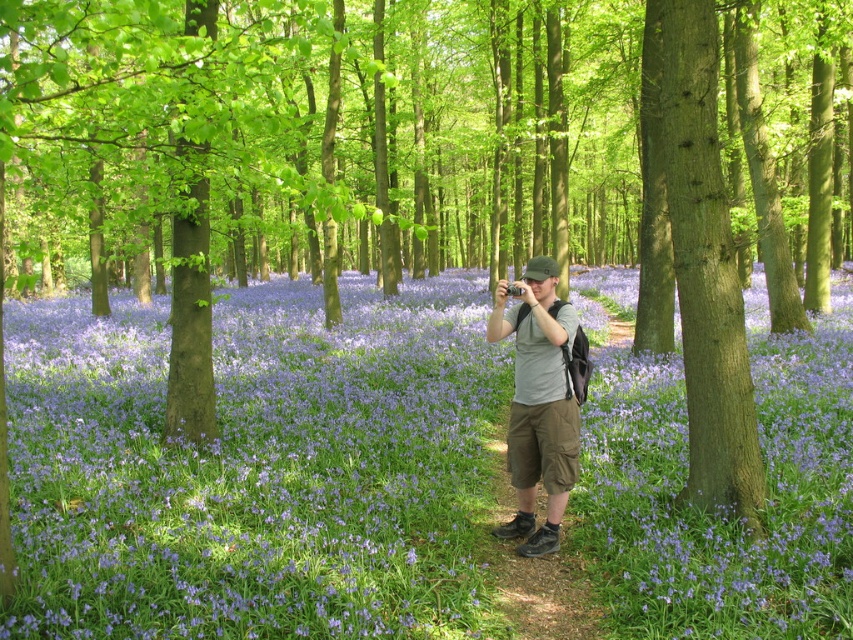
You are a hiker who wants to take a photo of the purple matte flower at center and the smooth brown tree trunk at center. Which object should you focus on first if you want to capture both in the same frame without moving the camera?

You should focus on the smooth brown tree trunk at center first because it is above the purple matte flower at center, so adjusting the focus to the tree trunk will ensure both are in the frame as the flower is below it.